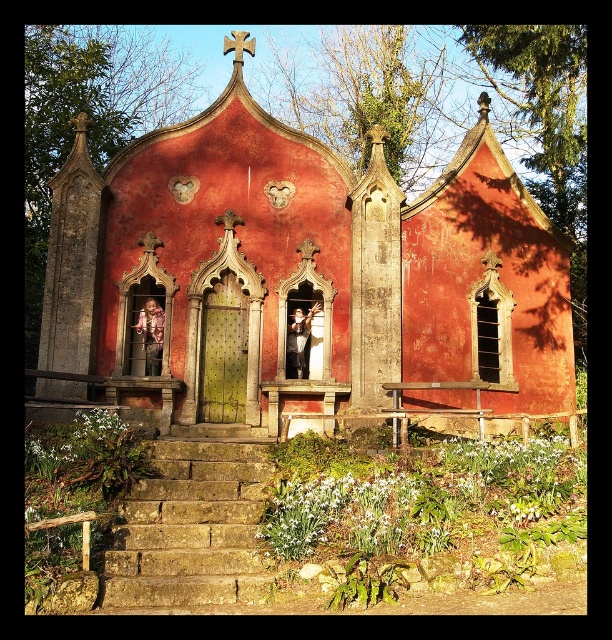
Question: Can you confirm if rustic stone chapel at center is positioned below smooth white dress at center?

Choices:
 (A) no
 (B) yes

Answer: (A)

Question: Which point is farther from the camera taking this photo?

Choices:
 (A) (252, 44)
 (B) (146, 573)

Answer: (A)

Question: Can you confirm if rustic stone chapel at center is positioned to the left of floral-patterned sweater at center?

Choices:
 (A) yes
 (B) no

Answer: (B)

Question: Can you confirm if stone steps at center is positioned to the right of smooth white dress at center?

Choices:
 (A) no
 (B) yes

Answer: (A)

Question: Which point appears closest to the camera in this image?

Choices:
 (A) (155, 324)
 (B) (365, 280)

Answer: (B)

Question: Which object is closer to the camera taking this photo?

Choices:
 (A) smooth wooden cross at upper center
 (B) rustic stone chapel at center
 (C) smooth white dress at center

Answer: (B)